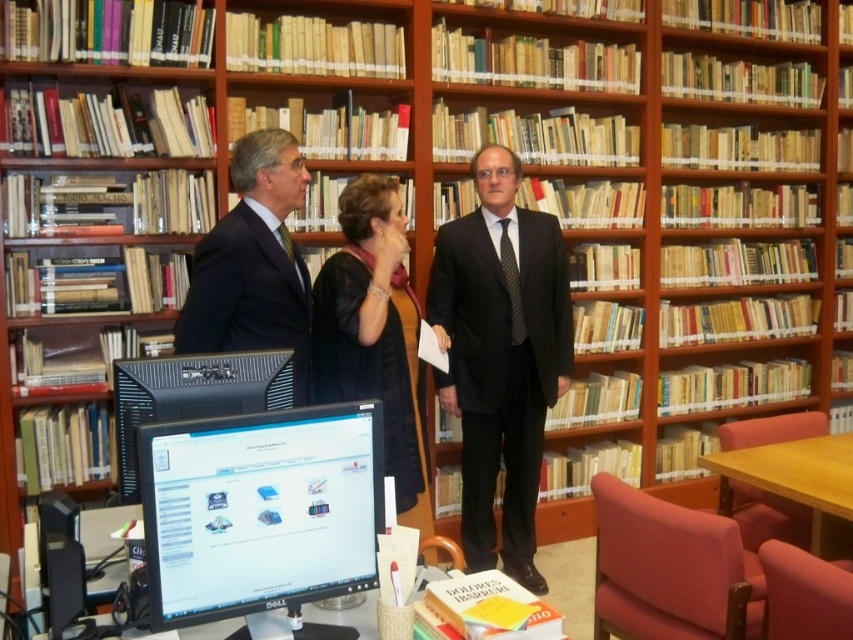
Question: Can you confirm if matte black monitor at center is positioned to the left of black silk suit at center?

Choices:
 (A) no
 (B) yes

Answer: (B)

Question: Among these points, which one is nearest to the camera?

Choices:
 (A) (323, 492)
 (B) (440, 285)
 (C) (332, 316)
 (D) (192, 330)

Answer: (A)

Question: Is matte black suit at center above black plastic monitor at center?

Choices:
 (A) no
 (B) yes

Answer: (B)

Question: Among these objects, which one is farthest from the camera?

Choices:
 (A) black silk suit at center
 (B) matte black suit at center
 (C) black suit at center

Answer: (A)

Question: Does black silk suit at center appear over black plastic monitor at center?

Choices:
 (A) yes
 (B) no

Answer: (B)

Question: Which object appears closest to the camera in this image?

Choices:
 (A) matte black suit at center
 (B) black suit at center
 (C) black plastic monitor at center
 (D) black silk suit at center

Answer: (C)